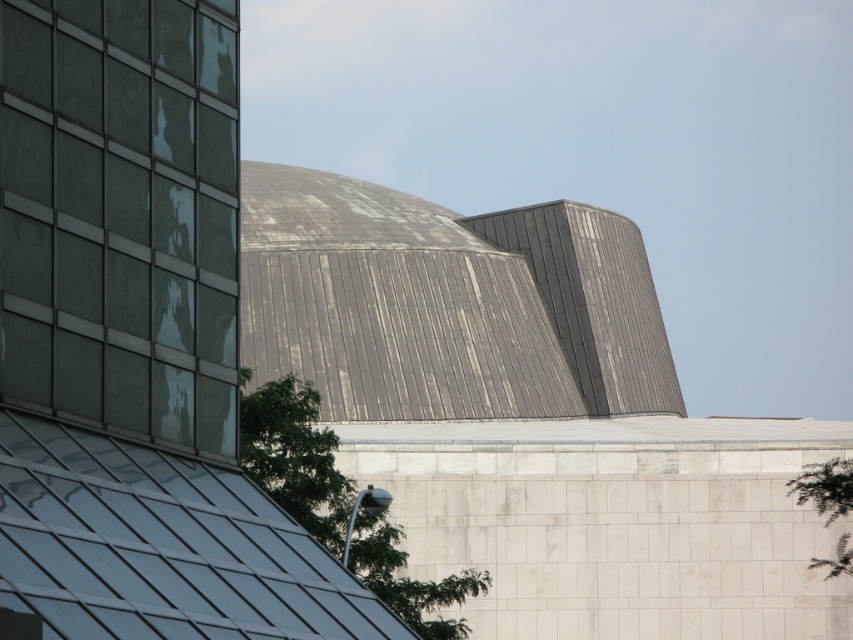
Is point (312, 508) more distant than point (833, 566)?

That is False.

Image resolution: width=853 pixels, height=640 pixels. In order to click on green leafy tree at center in this screenshot , I will do `click(294, 456)`.

The width and height of the screenshot is (853, 640). Identify the location of green leafy tree at center. (294, 456).